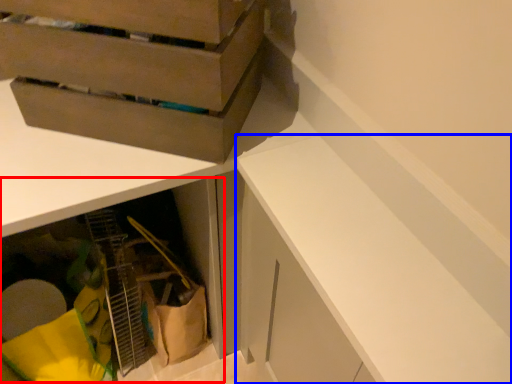
Question: Which object is further to the camera taking this photo, cabinetry (highlighted by a red box) or cabinetry (highlighted by a blue box)?

Choices:
 (A) cabinetry
 (B) cabinetry

Answer: (A)